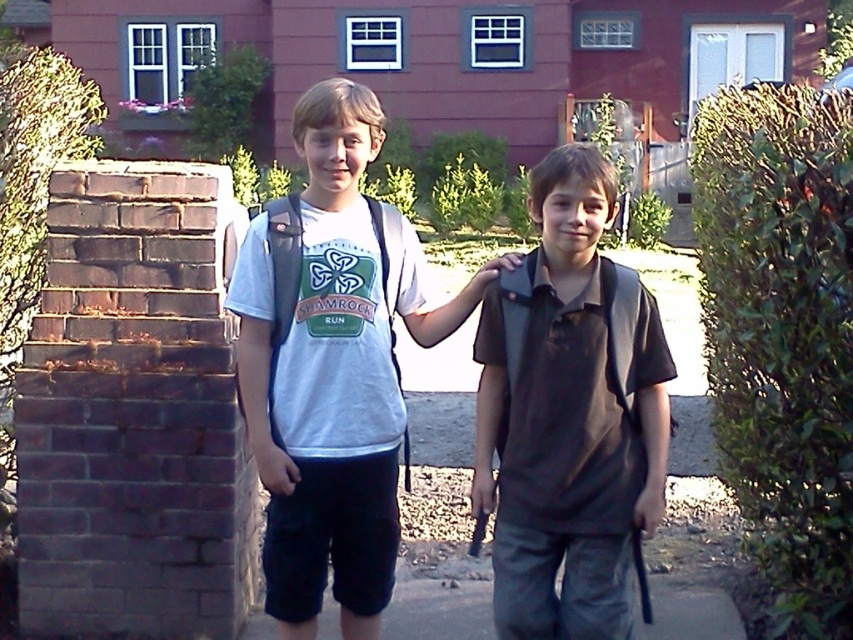
Is white matte t-shirt at center above gray concrete pavement at lower center?

Indeed, white matte t-shirt at center is positioned over gray concrete pavement at lower center.

Does white matte t-shirt at center have a lesser height compared to gray concrete pavement at lower center?

No, white matte t-shirt at center is not shorter than gray concrete pavement at lower center.

Does point (332, 93) come farther from viewer compared to point (460, 589)?

That is False.

Identify the location of white matte t-shirt at center. This screenshot has width=853, height=640. (323, 381).

Can you confirm if dark brown shirt at center is taller than white matte t-shirt at center?

In fact, dark brown shirt at center may be shorter than white matte t-shirt at center.

At what (x,y) coordinates should I click in order to perform the action: click on dark brown shirt at center. Please return your answer as a coordinate pair (x, y). Looking at the image, I should click on (569, 413).

Is dark brown shirt at center to the left of gray concrete pavement at lower center from the viewer's perspective?

No, dark brown shirt at center is not to the left of gray concrete pavement at lower center.

Who is higher up, dark brown shirt at center or gray concrete pavement at lower center?

Positioned higher is dark brown shirt at center.

Describe the element at coordinates (569, 413) in the screenshot. I see `dark brown shirt at center` at that location.

Locate an element on the screen. This screenshot has width=853, height=640. dark brown shirt at center is located at coordinates (569, 413).